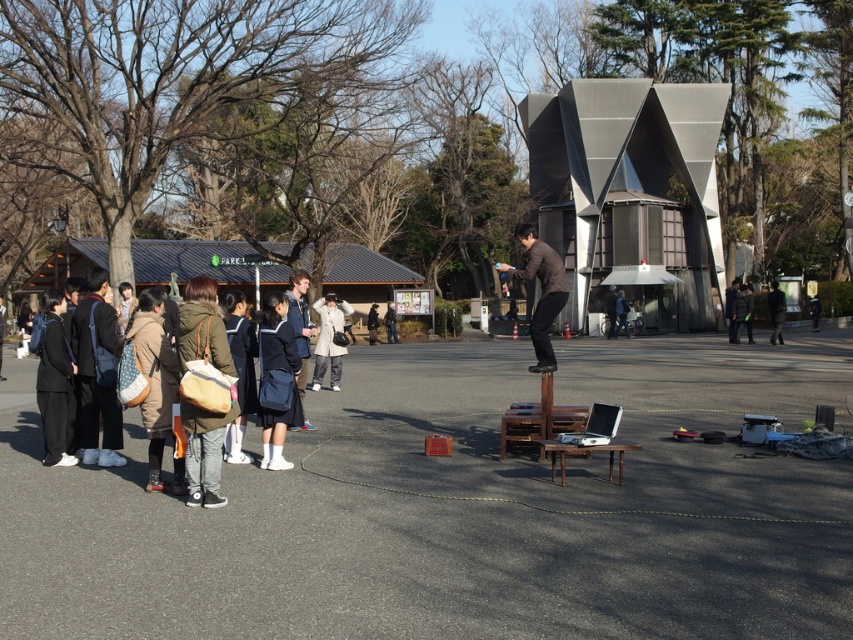
Question: Is the position of dark blue jacket at left more distant than that of brown leather jacket at center?

Choices:
 (A) yes
 (B) no

Answer: (A)

Question: Is dark blue jacket at left below brown leather jacket at center?

Choices:
 (A) no
 (B) yes

Answer: (B)

Question: Does dark blue jacket at left appear over brown leather jacket at center?

Choices:
 (A) no
 (B) yes

Answer: (A)

Question: Which of the following is the farthest from the observer?

Choices:
 (A) (111, 400)
 (B) (544, 301)

Answer: (B)

Question: Among these objects, which one is farthest from the camera?

Choices:
 (A) dark blue jacket at left
 (B) brown leather jacket at center

Answer: (A)